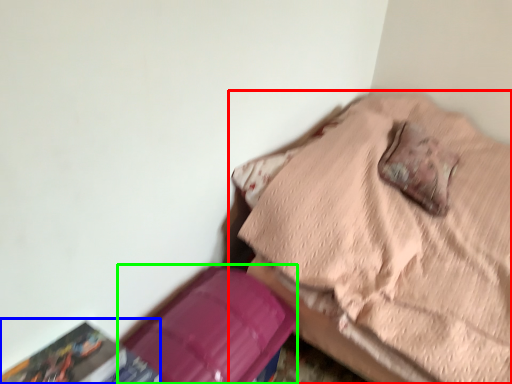
Question: Which object is the farthest from furniture (highlighted by a red box)? Choose among these: paperback book (highlighted by a blue box) or cardboard box (highlighted by a green box).

Choices:
 (A) paperback book
 (B) cardboard box

Answer: (A)